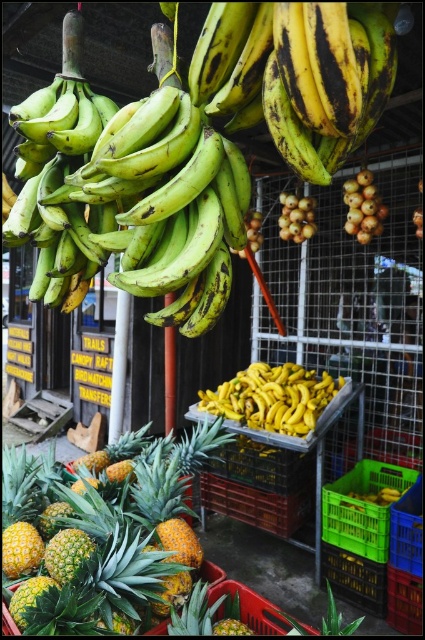
Does point (198, 193) come in front of point (354, 138)?

No, (198, 193) is behind (354, 138).

Identify the location of green matte bananas at upper left. (132, 196).

Is green matte bananas at upper left positioned before yellow spiky pineapple at center?

Yes, it is.

You are a GUI agent. You are given a task and a screenshot of the screen. Output one action in this format:
    pyautogui.click(x=<x>, y=<y>)
    Task: Click on the green matte bananas at upper left
    The height and width of the screenshot is (640, 425).
    Given the screenshot: What is the action you would take?
    pyautogui.click(x=132, y=196)

Between point (172, 99) and point (223, 397), which one is positioned in front?

Point (172, 99) is in front.

Locate an element on the screen. This screenshot has width=425, height=640. green matte bananas at upper left is located at coordinates (132, 196).

Who is more distant from viewer, (155, 321) or (308, 385)?

The point (308, 385) is behind.

Where is `green matte bananas at upper left`? The height and width of the screenshot is (640, 425). green matte bananas at upper left is located at coordinates (132, 196).